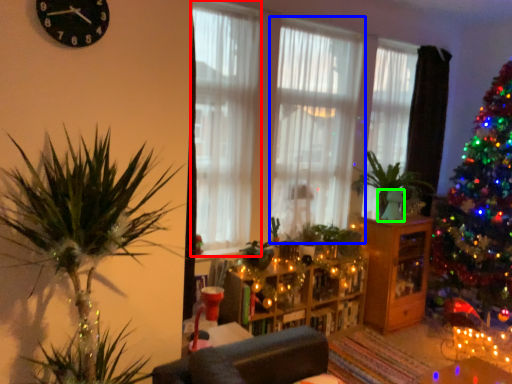
Question: Which object is the closest to the curtain (highlighted by a red box)? Choose among these: curtain (highlighted by a blue box) or glass vase (highlighted by a green box).

Choices:
 (A) curtain
 (B) glass vase

Answer: (A)